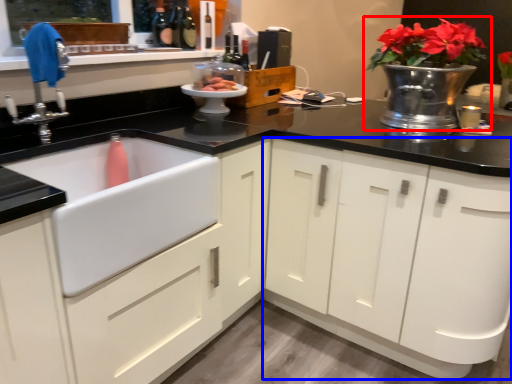
Question: Which object appears farthest to the camera in this image, houseplant (highlighted by a red box) or cabinetry (highlighted by a blue box)?

Choices:
 (A) houseplant
 (B) cabinetry

Answer: (A)